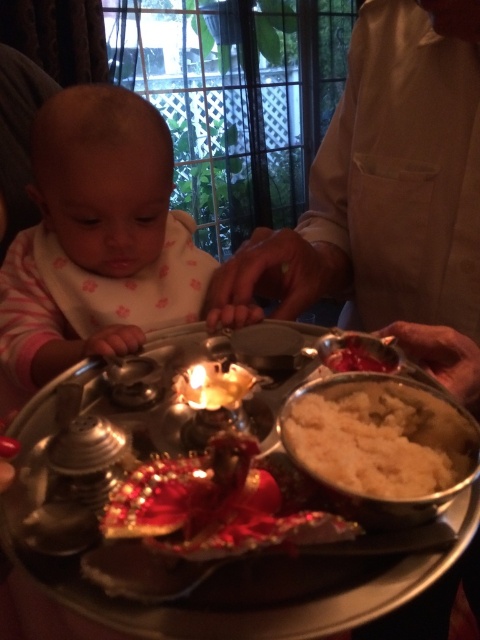
Who is taller, light beige fabric at center or white matte rice at center?

light beige fabric at center

Is light beige fabric at center to the left of white matte rice at center from the viewer's perspective?

In fact, light beige fabric at center is to the right of white matte rice at center.

Who is more distant from viewer, (370, 195) or (348, 406)?

The point (370, 195) is more distant.

Locate an element on the screen. The width and height of the screenshot is (480, 640). light beige fabric at center is located at coordinates (391, 195).

Which is above, matte white bib at left or white matte rice at center?

matte white bib at left is above.

Where is `matte white bib at left`? The height and width of the screenshot is (640, 480). matte white bib at left is located at coordinates point(97,237).

You are a GUI agent. You are given a task and a screenshot of the screen. Output one action in this format:
    pyautogui.click(x=<x>, y=<y>)
    Task: Click on the matte white bib at left
    Image resolution: width=480 pixels, height=640 pixels.
    Given the screenshot: What is the action you would take?
    pyautogui.click(x=97, y=237)

Which is more to the right, light beige fabric at center or matte white bib at left?

From the viewer's perspective, light beige fabric at center appears more on the right side.

Who is more forward, (459,88) or (76,243)?

Point (459,88)

Locate an element on the screen. light beige fabric at center is located at coordinates (391, 195).